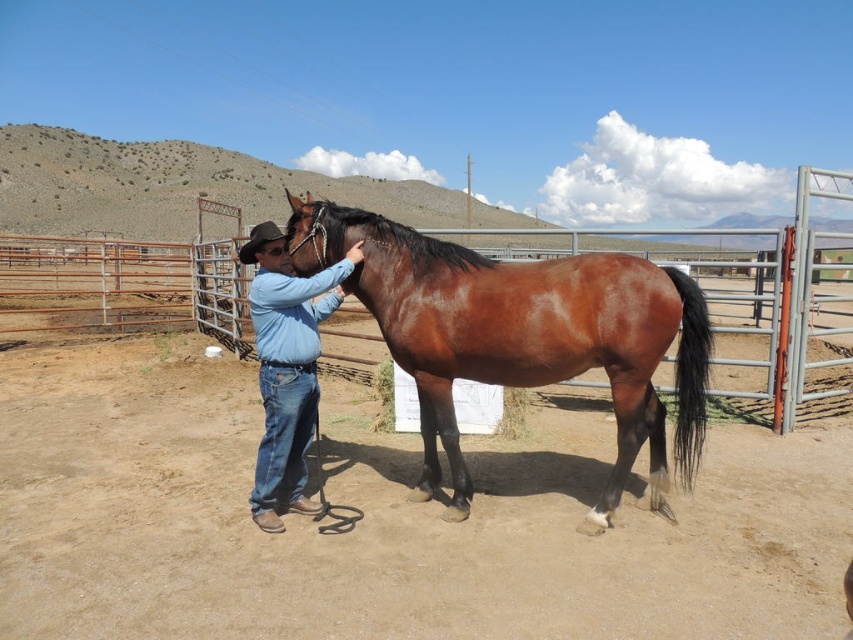
Can you confirm if brown glossy horse at center is smaller than blue jeans at center?

No.

Is brown glossy horse at center below blue jeans at center?

No.

Who is more distant from viewer, (425, 451) or (273, 250)?

Positioned behind is point (425, 451).

At what (x,y) coordinates should I click in order to perform the action: click on brown glossy horse at center. Please return your answer as a coordinate pair (x, y). Image resolution: width=853 pixels, height=640 pixels. Looking at the image, I should click on (521, 336).